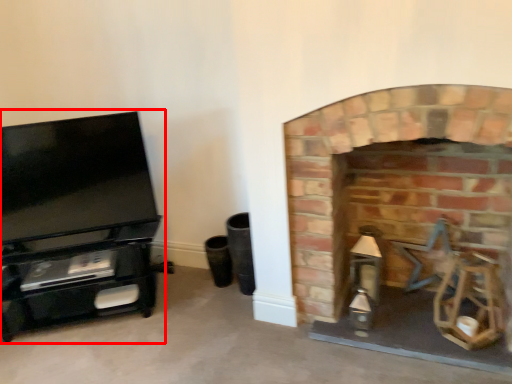
Question: Where is entertainment center (annotated by the red box) located in relation to fireplace in the image?

Choices:
 (A) left
 (B) right

Answer: (A)